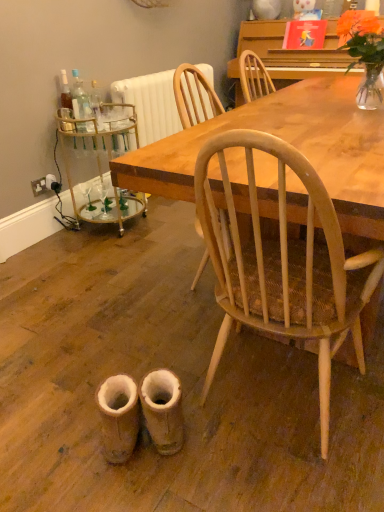
Question: From the image's perspective, is clear glass bottle at left located beneath gold mirrored bar cart at left?

Choices:
 (A) no
 (B) yes

Answer: (A)

Question: Is clear glass bottle at left in contact with gold mirrored bar cart at left?

Choices:
 (A) no
 (B) yes

Answer: (A)

Question: Does clear glass bottle at left have a lesser width compared to gold mirrored bar cart at left?

Choices:
 (A) no
 (B) yes

Answer: (B)

Question: Is the depth of clear glass bottle at left less than that of gold mirrored bar cart at left?

Choices:
 (A) yes
 (B) no

Answer: (B)

Question: Can you confirm if clear glass bottle at left is shorter than gold mirrored bar cart at left?

Choices:
 (A) no
 (B) yes

Answer: (B)

Question: Does clear glass bottle at left contain gold mirrored bar cart at left?

Choices:
 (A) yes
 (B) no

Answer: (B)

Question: Considering the relative sizes of clear glass bottle at left and wooden table at center in the image provided, is clear glass bottle at left taller than wooden table at center?

Choices:
 (A) yes
 (B) no

Answer: (B)

Question: Is wooden table at center at the back of clear glass bottle at left?

Choices:
 (A) no
 (B) yes

Answer: (A)

Question: From the image's perspective, is clear glass bottle at left over wooden table at center?

Choices:
 (A) no
 (B) yes

Answer: (B)

Question: Is clear glass bottle at left further to camera compared to wooden table at center?

Choices:
 (A) yes
 (B) no

Answer: (A)

Question: Can you confirm if clear glass bottle at left is thinner than wooden table at center?

Choices:
 (A) yes
 (B) no

Answer: (A)

Question: Is clear glass bottle at left aimed at wooden table at center?

Choices:
 (A) yes
 (B) no

Answer: (B)

Question: From a real-world perspective, is leather boot at lower center, which is counted as the second walking shoe, starting from the left, beneath orange matte flower at upper right?

Choices:
 (A) yes
 (B) no

Answer: (A)